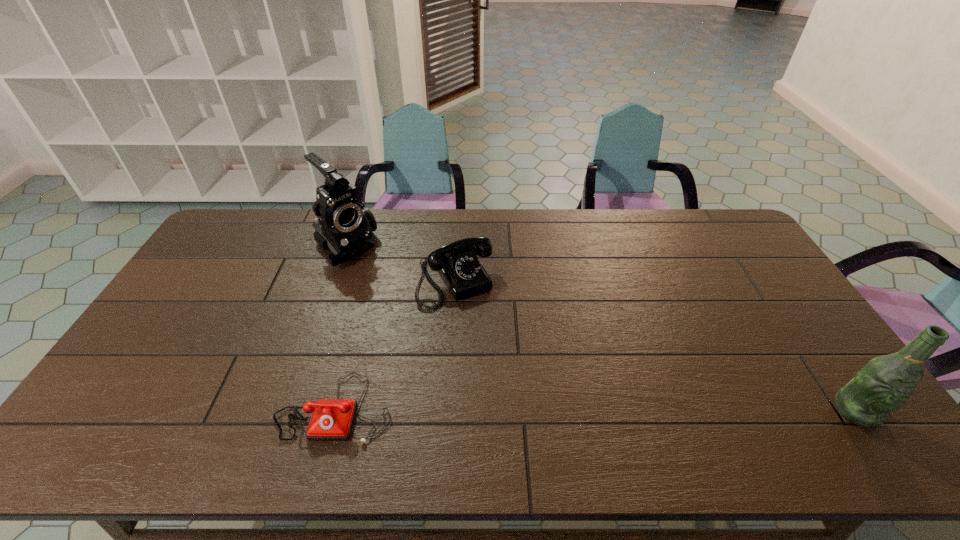
At what (x,y) coordinates should I click in order to perform the action: click on free point between the beer bottle and the farther telephone. Please return your answer as a coordinate pair (x, y). The height and width of the screenshot is (540, 960). Looking at the image, I should click on (656, 346).

At what (x,y) coordinates should I click in order to perform the action: click on unoccupied position between the right telephone and the left telephone. Please return your answer as a coordinate pair (x, y). Image resolution: width=960 pixels, height=540 pixels. Looking at the image, I should click on (396, 345).

Choose which object is the nearest neighbor to the second object from right to left. Please provide its 2D coordinates. Your answer should be formatted as a tuple, i.e. [(x, y)], where the tuple contains the x and y coordinates of a point satisfying the conditions above.

[(345, 226)]

Find the location of a particular element. This screenshot has height=540, width=960. object that is the second closest to the camcorder is located at coordinates (332, 419).